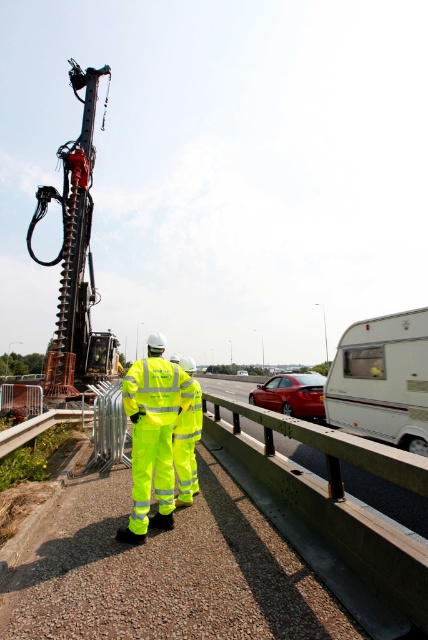
How distant is neon yellow reflective suit at center from glossy red car at center?

7.20 meters

Which of these two, neon yellow reflective suit at center or glossy red car at center, stands shorter?

With less height is glossy red car at center.

Is point (184, 401) more distant than point (312, 385)?

No, (184, 401) is in front of (312, 385).

Locate an element on the screen. The height and width of the screenshot is (640, 428). neon yellow reflective suit at center is located at coordinates (152, 435).

Does white matte trailer truck at right have a lesser width compared to glossy red car at center?

Yes.

Where is `white matte trailer truck at right`? white matte trailer truck at right is located at coordinates point(382,380).

What do you see at coordinates (382, 380) in the screenshot?
I see `white matte trailer truck at right` at bounding box center [382, 380].

I want to click on white matte trailer truck at right, so click(382, 380).

Between white matte trailer truck at right and neon yellow reflective suit at center, which one appears on the left side from the viewer's perspective?

Positioned to the left is neon yellow reflective suit at center.

Does white matte trailer truck at right have a larger size compared to neon yellow reflective suit at center?

Correct, white matte trailer truck at right is larger in size than neon yellow reflective suit at center.

Is point (374, 413) less distant than point (169, 422)?

No, it is behind (169, 422).

At what (x,y) coordinates should I click in order to perform the action: click on white matte trailer truck at right. Please return your answer as a coordinate pair (x, y). Looking at the image, I should click on (382, 380).